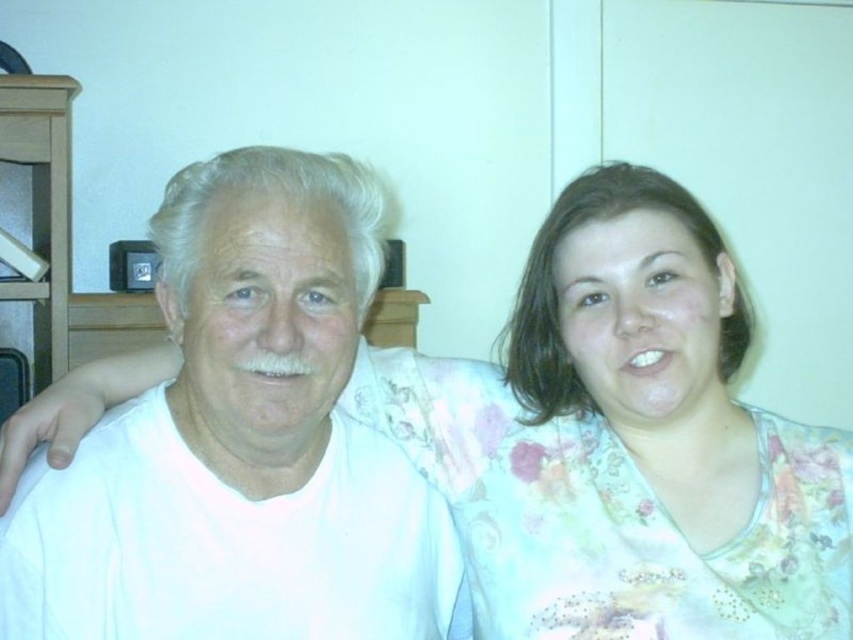
You are taking a photo of two people in a room. You notice two points in the image at coordinates point (332,177) and point (618,252). If you want to focus on the point that is closer to your camera, which coordinate should you choose?

You should choose point (332,177) because it is closer to the camera than point (618,252).

What are the coordinates of the white matte shirt at center?

The white matte shirt at center is located at point (x=244, y=442).